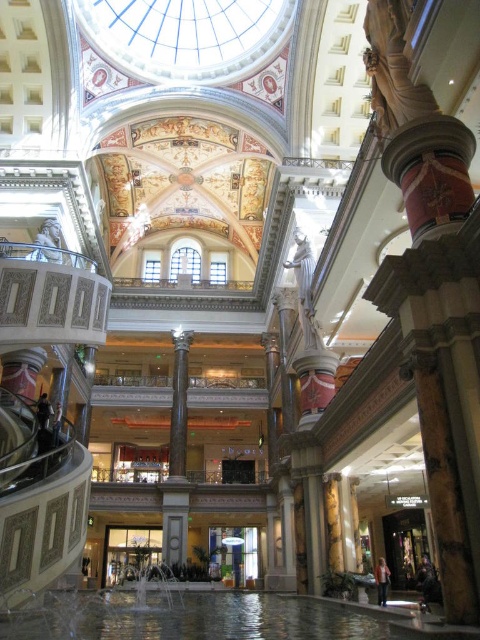
Can you confirm if black marble column at center is thinner than white marble statue at center?

No, black marble column at center is not thinner than white marble statue at center.

Does point (169, 472) lie in front of point (303, 307)?

No.

Locate an element on the screen. This screenshot has height=640, width=480. black marble column at center is located at coordinates (179, 404).